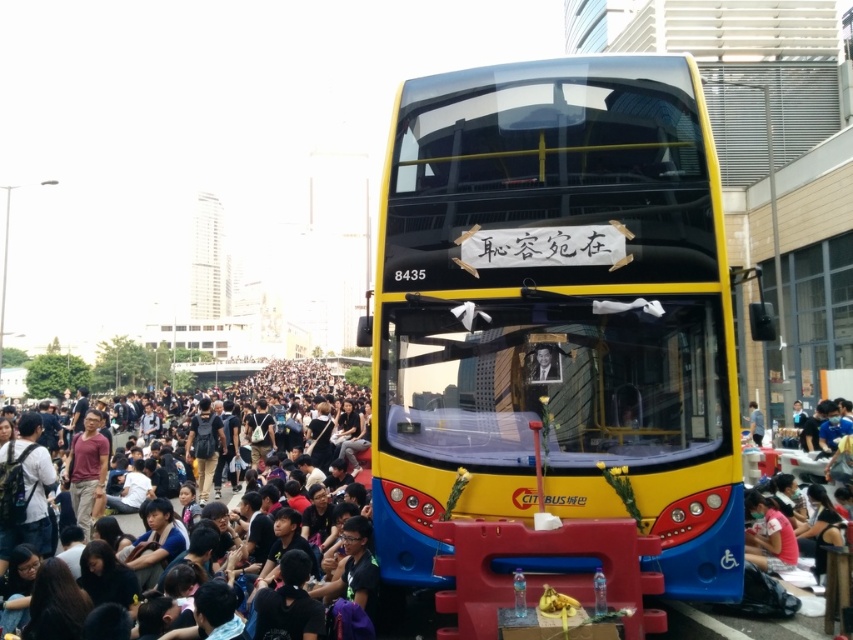
Between yellow matte bus at center and black fabric crowd at lower center, which one is positioned higher?

yellow matte bus at center

Does point (601, 106) come behind point (335, 413)?

No, it is in front of (335, 413).

Does point (474, 512) come farther from viewer compared to point (361, 365)?

No, it is in front of (361, 365).

You are a GUI agent. You are given a task and a screenshot of the screen. Output one action in this format:
    pyautogui.click(x=<x>, y=<y>)
    Task: Click on the yellow matte bus at center
    The width and height of the screenshot is (853, 640).
    Given the screenshot: What is the action you would take?
    pyautogui.click(x=556, y=310)